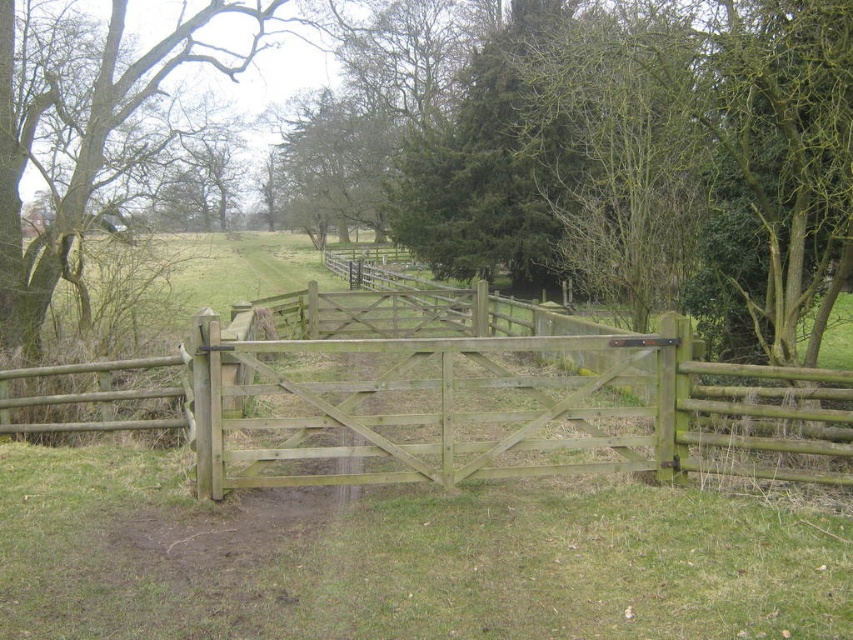
You are standing in front of the wooden gate and want to walk towards the point that is closer to you. Which point should you head towards, point (x=569, y=449) or point (x=18, y=237)?

You should head towards point (x=569, y=449) because it is closer to the viewer than point (x=18, y=237).

You are a painter who wants to paint the light brown wooden gate at center and the green wood tree at center. If you have a limited amount of paint, which object should you prioritize painting first to cover its entire surface area? Explain your reasoning based on their sizes.

The light brown wooden gate at center has a greater width than the green wood tree at center, so you should prioritize painting the light brown wooden gate at center first to ensure you have enough paint to cover its larger surface area.

You are standing in a field and see the light brown wooden gate at center and the green wood tree at center. Which object is positioned to the right of the other?

The light brown wooden gate at center is to the right of green wood tree at center.